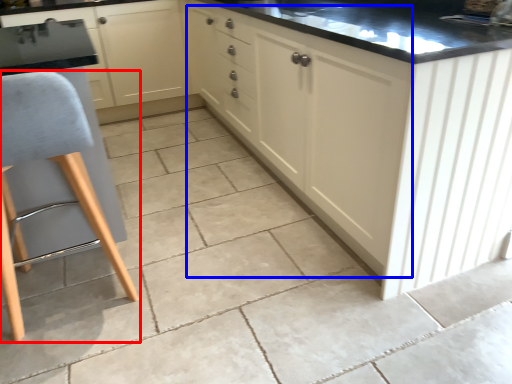
Question: Which object is further to the camera taking this photo, furniture (highlighted by a red box) or cabinetry (highlighted by a blue box)?

Choices:
 (A) furniture
 (B) cabinetry

Answer: (B)